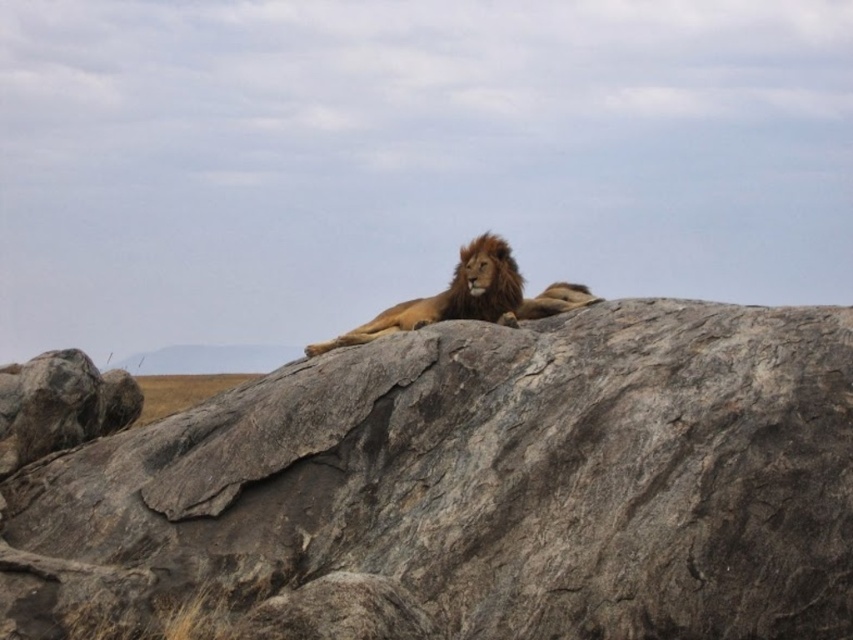
Question: Is gray rough rock at center wider than golden fur lion at center?

Choices:
 (A) no
 (B) yes

Answer: (B)

Question: Is gray rough rock at center further to the viewer compared to golden fur lion at center?

Choices:
 (A) yes
 (B) no

Answer: (B)

Question: Which object is closer to the camera taking this photo?

Choices:
 (A) gray rough rock at center
 (B) golden fur lion at center

Answer: (A)

Question: Which point is closer to the camera?

Choices:
 (A) (471, 317)
 (B) (335, 381)

Answer: (B)

Question: Can you confirm if gray rough rock at center is positioned above golden fur lion at center?

Choices:
 (A) yes
 (B) no

Answer: (B)